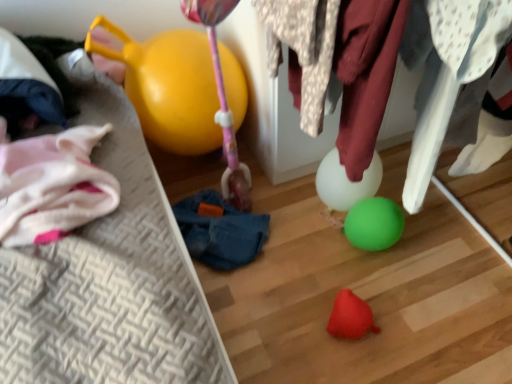
Question: Is rubber red toy at lower center wider than white fabric at upper right, marked as the first clothing in a right-to-left arrangement?

Choices:
 (A) no
 (B) yes

Answer: (A)

Question: Is rubber red toy at lower center positioned behind white fabric at upper right, marked as the first clothing in a right-to-left arrangement?

Choices:
 (A) no
 (B) yes

Answer: (B)

Question: From a real-world perspective, does rubber red toy at lower center stand above white fabric at upper right, the 2th clothing viewed from the left?

Choices:
 (A) yes
 (B) no

Answer: (B)

Question: From a real-world perspective, is rubber red toy at lower center located beneath white fabric at upper right, marked as the first clothing in a right-to-left arrangement?

Choices:
 (A) yes
 (B) no

Answer: (A)

Question: Considering the relative positions of rubber red toy at lower center and white fabric at upper right, the 2th clothing viewed from the left, in the image provided, is rubber red toy at lower center to the left of white fabric at upper right, the 2th clothing viewed from the left, from the viewer's perspective?

Choices:
 (A) yes
 (B) no

Answer: (A)

Question: Considering their positions, is rubber red toy at lower center located in front of or behind spotted fabric at center, the 1th clothing in the left-to-right sequence?

Choices:
 (A) behind
 (B) front

Answer: (A)

Question: Do you think rubber red toy at lower center is within spotted fabric at center, which ranks as the 2th clothing in right-to-left order, or outside of it?

Choices:
 (A) outside
 (B) inside

Answer: (A)

Question: Considering the positions of rubber red toy at lower center and spotted fabric at center, which ranks as the 2th clothing in right-to-left order, in the image, is rubber red toy at lower center taller or shorter than spotted fabric at center, which ranks as the 2th clothing in right-to-left order,?

Choices:
 (A) tall
 (B) short

Answer: (B)

Question: Is point (377, 332) positioned closer to the camera than point (269, 74)?

Choices:
 (A) farther
 (B) closer

Answer: (B)

Question: Relative to rubber red toy at lower center, is blue fabric bean bag chair at center in front or behind?

Choices:
 (A) front
 (B) behind

Answer: (B)

Question: Is blue fabric bean bag chair at center inside the boundaries of rubber red toy at lower center, or outside?

Choices:
 (A) outside
 (B) inside

Answer: (A)

Question: Is point (222, 205) positioned closer to the camera than point (338, 326)?

Choices:
 (A) farther
 (B) closer

Answer: (A)

Question: From a real-world perspective, is blue fabric bean bag chair at center positioned above or below rubber red toy at lower center?

Choices:
 (A) above
 (B) below

Answer: (A)

Question: From the image's perspective, relative to rubber red toy at lower center, is white fabric at upper right, the 2th clothing viewed from the left, above or below?

Choices:
 (A) above
 (B) below

Answer: (A)

Question: Considering the positions of white fabric at upper right, the 2th clothing viewed from the left, and rubber red toy at lower center in the image, is white fabric at upper right, the 2th clothing viewed from the left, wider or thinner than rubber red toy at lower center?

Choices:
 (A) thin
 (B) wide

Answer: (B)